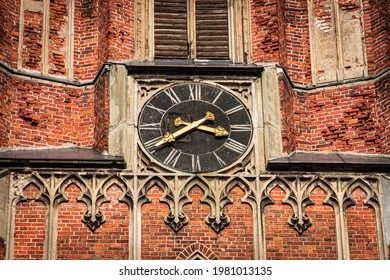
In order to click on clock minute hand in this screenshot , I will do `click(167, 137)`.